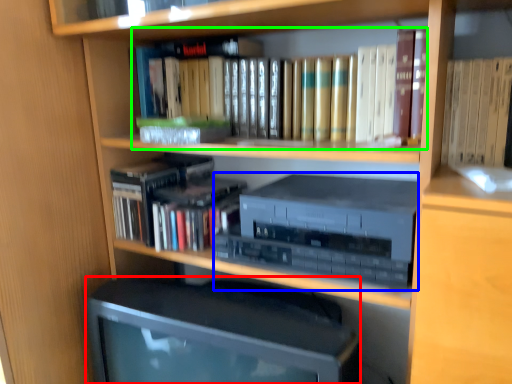
Question: Estimate the real-world distances between objects in this image. Which object is farther from computer monitor (highlighted by a red box), stereo (highlighted by a blue box) or book (highlighted by a green box)?

Choices:
 (A) stereo
 (B) book

Answer: (B)